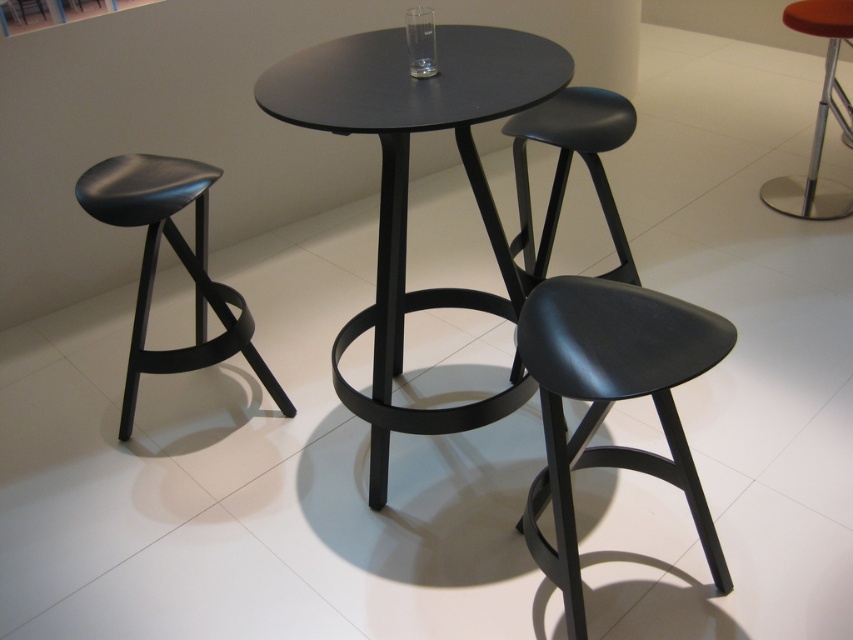
Is matte black stool at center closer to camera compared to matte black stool at left?

Yes.

Identify the location of matte black stool at center. (611, 401).

Can you confirm if matte black stool at center is positioned to the right of orange leather bar stool at right?

In fact, matte black stool at center is to the left of orange leather bar stool at right.

Between matte black stool at center and orange leather bar stool at right, which one appears on the left side from the viewer's perspective?

Positioned to the left is matte black stool at center.

Locate an element on the screen. The height and width of the screenshot is (640, 853). matte black stool at center is located at coordinates (611, 401).

Between black matte table at center and matte black stool at center, which one appears on the right side from the viewer's perspective?

Positioned to the right is matte black stool at center.

Does point (489, 312) lie in front of point (566, 490)?

That is False.

Find the location of a particular element. This screenshot has height=640, width=853. black matte table at center is located at coordinates [407, 182].